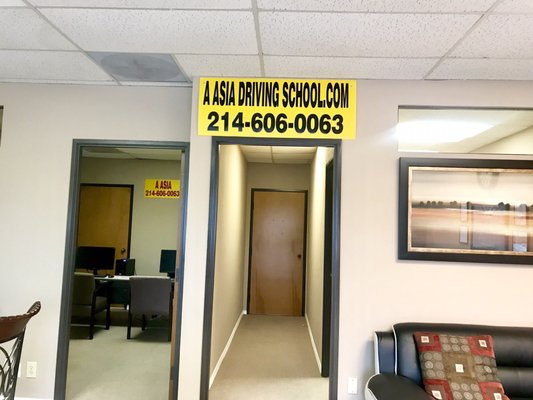
I want to click on black couch, so click(506, 350), click(415, 389).